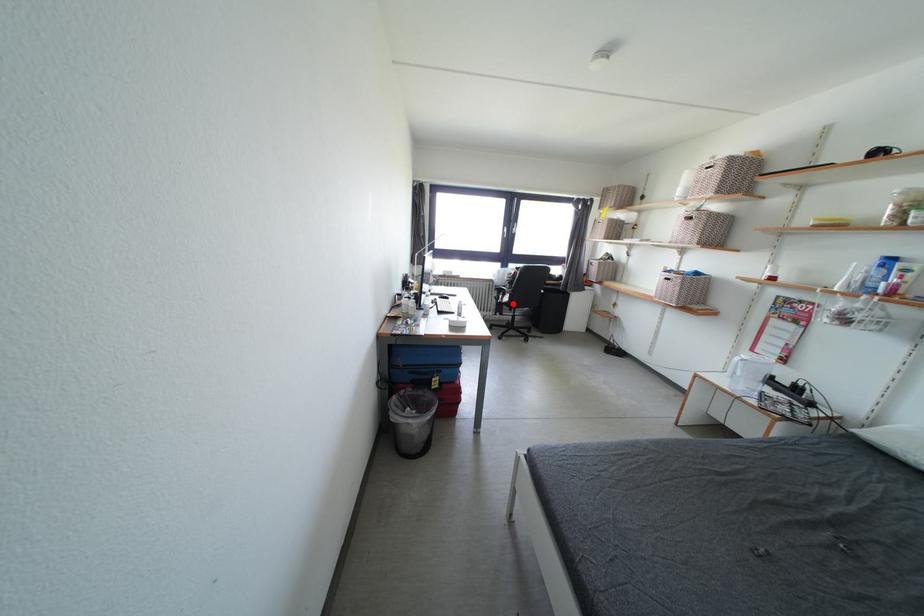
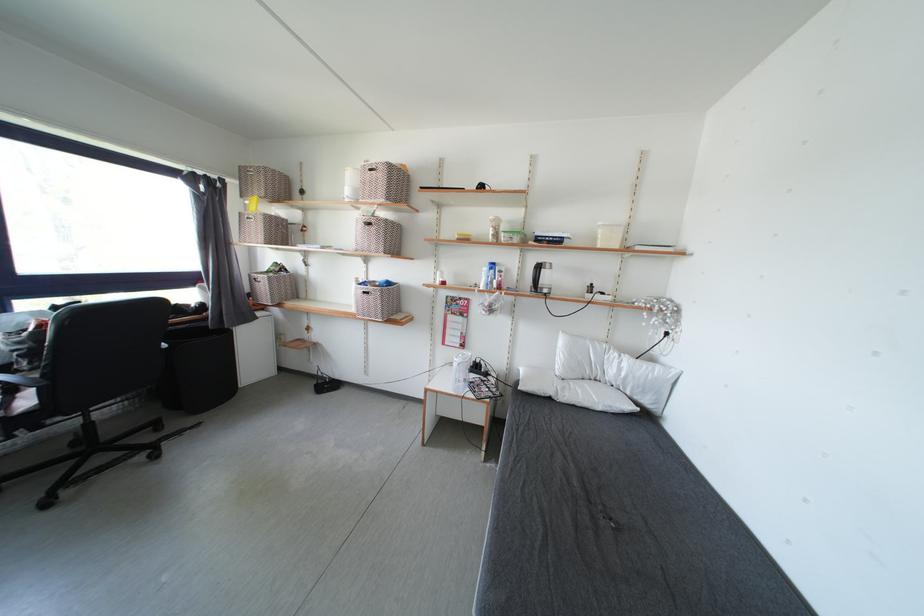
Question: A red point is marked in image1. In image2, is the corresponding 3D point closer to the camera or farther? Reply with the corresponding letter.

Choices:
 (A) The corresponding 3D point is closer.
 (B) The corresponding 3D point is farther.

Answer: (A)